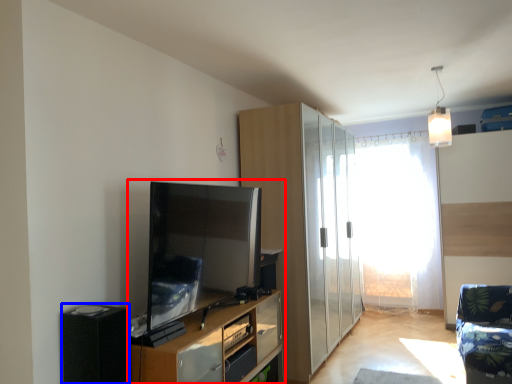
Question: Which object appears farthest to the camera in this image, entertainment center (highlighted by a red box) or appliance (highlighted by a blue box)?

Choices:
 (A) entertainment center
 (B) appliance

Answer: (A)